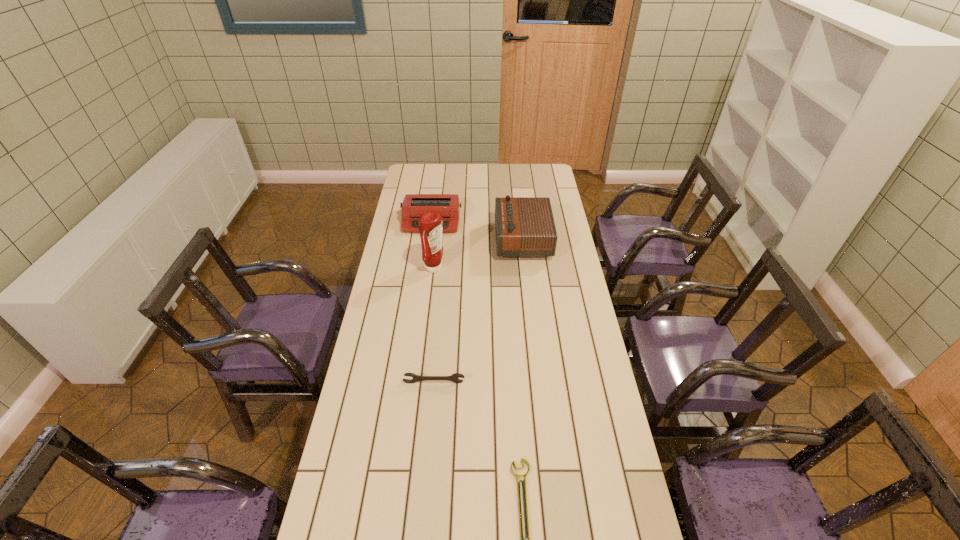
Image resolution: width=960 pixels, height=540 pixels. In order to click on vacant space located on the open ends of the fourth farthest object in this screenshot , I will do `click(432, 409)`.

In order to click on typewriter that is at the left edge in this screenshot , I will do `click(414, 206)`.

You are a GUI agent. You are given a task and a screenshot of the screen. Output one action in this format:
    pyautogui.click(x=<x>, y=<y>)
    Task: Click on the wrench located in the left edge section of the desktop
    The width and height of the screenshot is (960, 540).
    Given the screenshot: What is the action you would take?
    pyautogui.click(x=453, y=377)

Where is `object present at the right edge`? This screenshot has width=960, height=540. object present at the right edge is located at coordinates pyautogui.click(x=524, y=226).

This screenshot has width=960, height=540. I want to click on vacant position at the far edge of the desktop, so pos(483,179).

What are the coordinates of `vacant position at the left edge of the desktop` in the screenshot? It's located at 395,303.

I want to click on vacant area that lies between the radio receiver and the left wrench, so click(478, 311).

Locate an element on the screen. The width and height of the screenshot is (960, 540). empty space between the fourth shortest object and the fourth tallest object is located at coordinates (478, 311).

The width and height of the screenshot is (960, 540). In order to click on free point between the radio receiver and the third shortest object in this screenshot , I will do `click(477, 231)`.

The width and height of the screenshot is (960, 540). I want to click on vacant space that's between the radio receiver and the condiment, so click(479, 254).